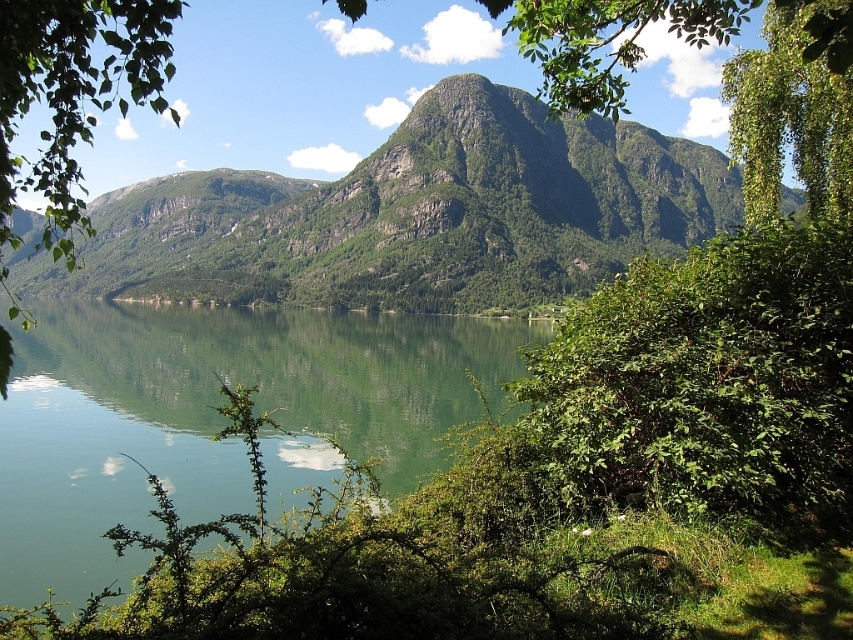
Question: Does green textured mountain at center appear on the right side of green reflective water at center?

Choices:
 (A) yes
 (B) no

Answer: (B)

Question: Which point is farther to the camera?

Choices:
 (A) green reflective water at center
 (B) green textured mountain at center

Answer: (B)

Question: Which object is closer to the camera taking this photo?

Choices:
 (A) green textured mountain at center
 (B) green reflective water at center
 (C) green leafy branch at left

Answer: (C)

Question: Does green reflective water at center have a larger size compared to green leafy branch at left?

Choices:
 (A) yes
 (B) no

Answer: (B)

Question: Does green textured mountain at center have a smaller size compared to green reflective water at center?

Choices:
 (A) yes
 (B) no

Answer: (B)

Question: Which object is the farthest from the green leafy branch at left?

Choices:
 (A) green reflective water at center
 (B) green textured mountain at center

Answer: (B)